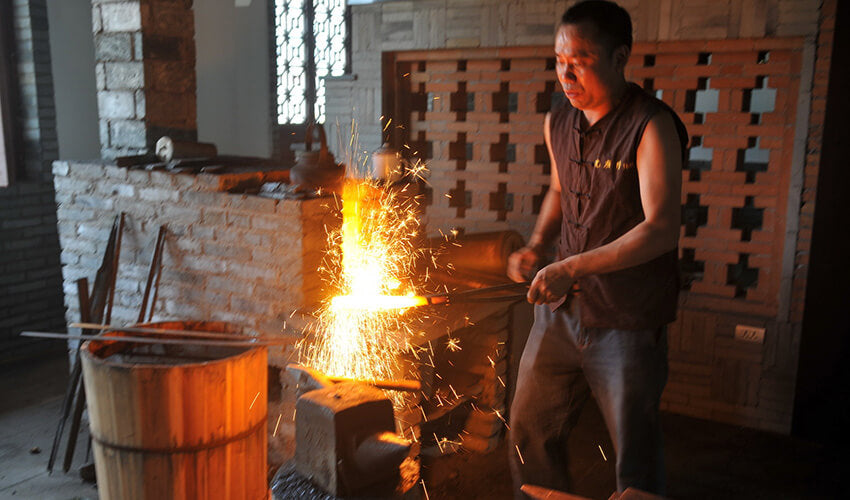
The width and height of the screenshot is (850, 500). Find the location of `kettle`. kettle is located at coordinates (314, 175).